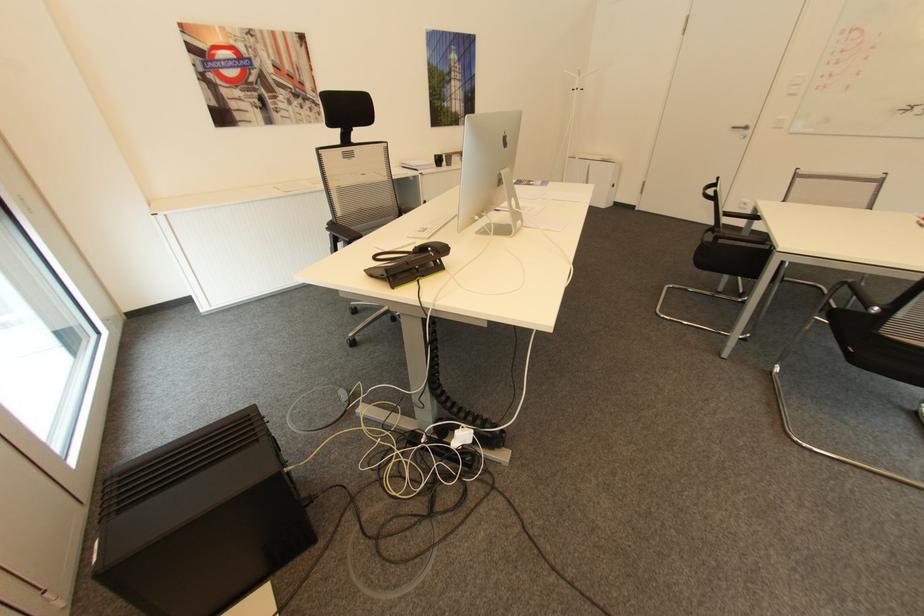
At what (x,y) coordinates should I click in order to perform the action: click on black telephone handset. Please return your answer as a coordinate pair (x, y). This screenshot has height=616, width=924. Looking at the image, I should click on (406, 257).